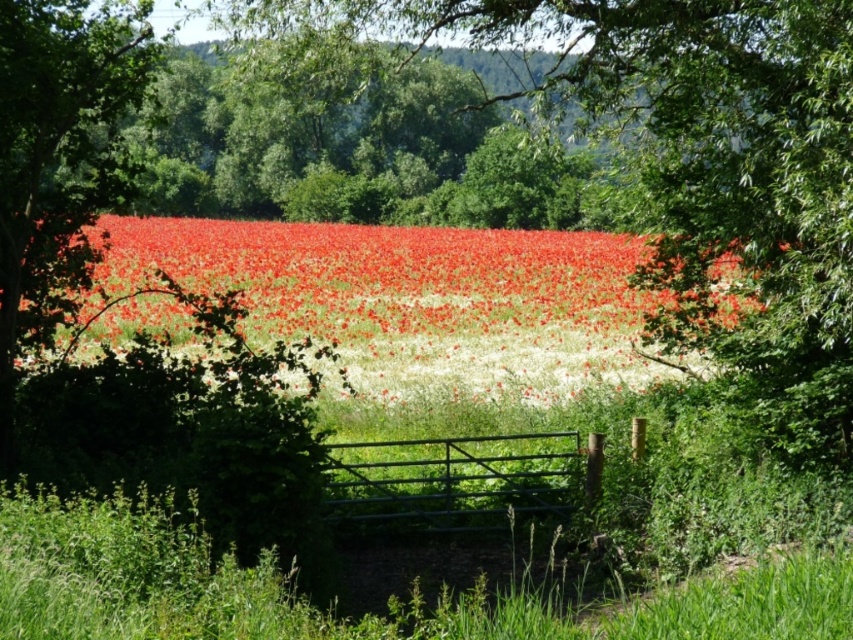
Question: Among these objects, which one is farthest from the camera?

Choices:
 (A) metallic gate at center
 (B) bright red petals at center

Answer: (B)

Question: Is green leafy tree at center below bright red petals at center?

Choices:
 (A) yes
 (B) no

Answer: (B)

Question: Is green leafy tree at center positioned at the back of bright red petals at center?

Choices:
 (A) no
 (B) yes

Answer: (A)

Question: Is bright red petals at center smaller than metallic gate at center?

Choices:
 (A) no
 (B) yes

Answer: (A)

Question: Which of the following is the closest to the observer?

Choices:
 (A) (395, 292)
 (B) (741, 6)
 (C) (378, 461)

Answer: (B)

Question: Among these objects, which one is nearest to the camera?

Choices:
 (A) bright red petals at center
 (B) metallic gate at center
 (C) green leafy tree at center

Answer: (C)